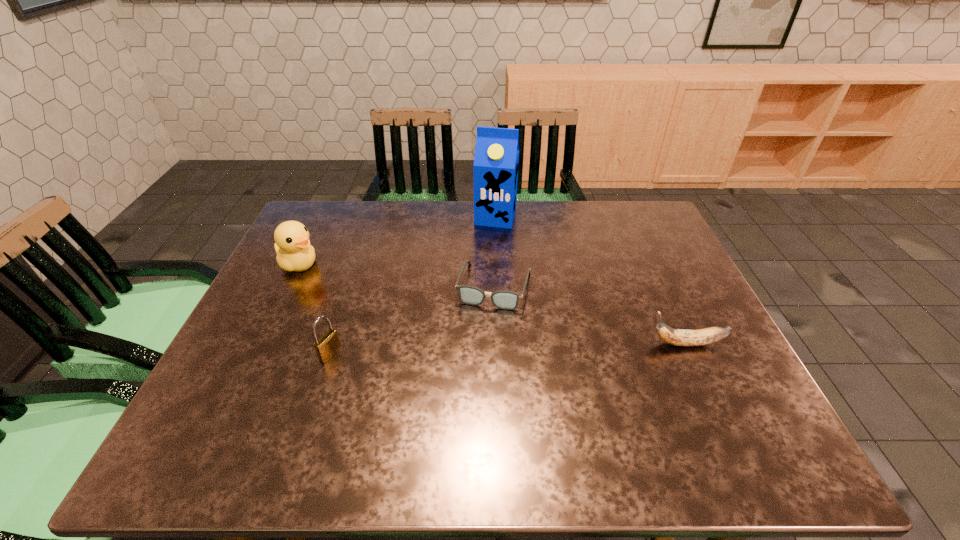
Identify the location of free location located on the face of the duck. (430, 320).

This screenshot has width=960, height=540. Identify the location of vacant space located on the face of the duck. (430, 320).

Identify the location of object present at the far edge. (496, 160).

The width and height of the screenshot is (960, 540). I want to click on object present at the left edge, so click(x=292, y=245).

The width and height of the screenshot is (960, 540). What are the coordinates of `object that is at the right edge` in the screenshot? It's located at (680, 337).

In the image, there is a desktop. Identify the location of free space at the far edge. Image resolution: width=960 pixels, height=540 pixels. (596, 205).

In the image, there is a desktop. Identify the location of vacant space at the near edge. (593, 384).

Locate an element on the screen. Image resolution: width=960 pixels, height=540 pixels. vacant region at the right edge of the desktop is located at coordinates (714, 379).

In the image, there is a desktop. At what (x,y) coordinates should I click in order to perform the action: click on free space at the far left corner. Please return your answer as a coordinate pair (x, y). The image size is (960, 540). Looking at the image, I should click on (322, 221).

The height and width of the screenshot is (540, 960). I want to click on blank space at the near left corner of the desktop, so click(x=257, y=400).